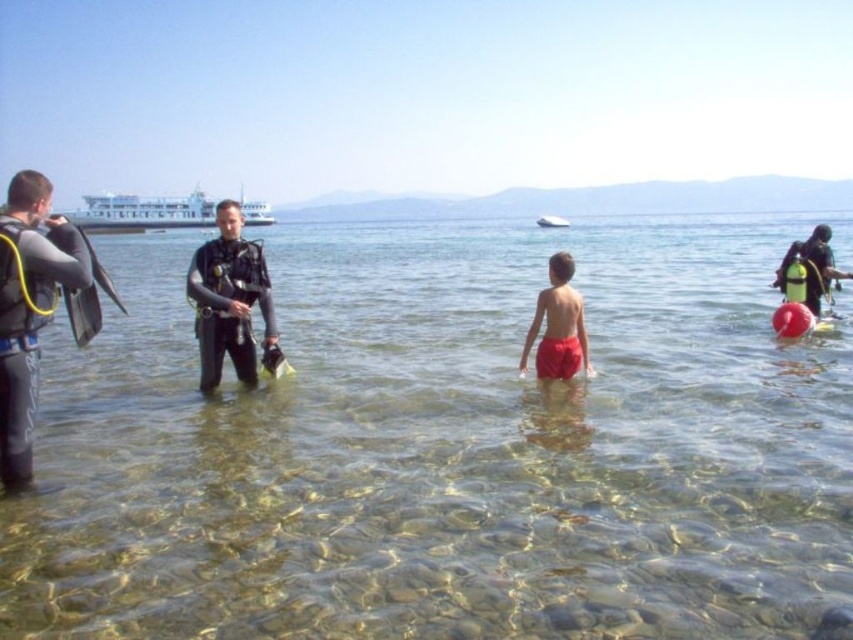
Question: Which object is the closest to the matte black wetsuit at left?

Choices:
 (A) clear water at center
 (B) black matte scuba gear at center

Answer: (B)

Question: Which object is positioned farthest from the red matte shorts at center?

Choices:
 (A) black matte scuba gear at center
 (B) clear water at center
 (C) white matte ferry at upper left

Answer: (C)

Question: Does red matte shorts at center appear on the right side of white matte boat at upper center?

Choices:
 (A) no
 (B) yes

Answer: (A)

Question: Which object is the closest to the matte black wetsuit at left?

Choices:
 (A) white matte ferry at upper left
 (B) black matte scuba gear at center
 (C) red matte shorts at center

Answer: (B)

Question: Is the position of clear water at center less distant than that of matte black wetsuit at left?

Choices:
 (A) no
 (B) yes

Answer: (B)

Question: Can you confirm if matte black wetsuit at left is positioned to the right of black matte scuba gear at center?

Choices:
 (A) no
 (B) yes

Answer: (A)